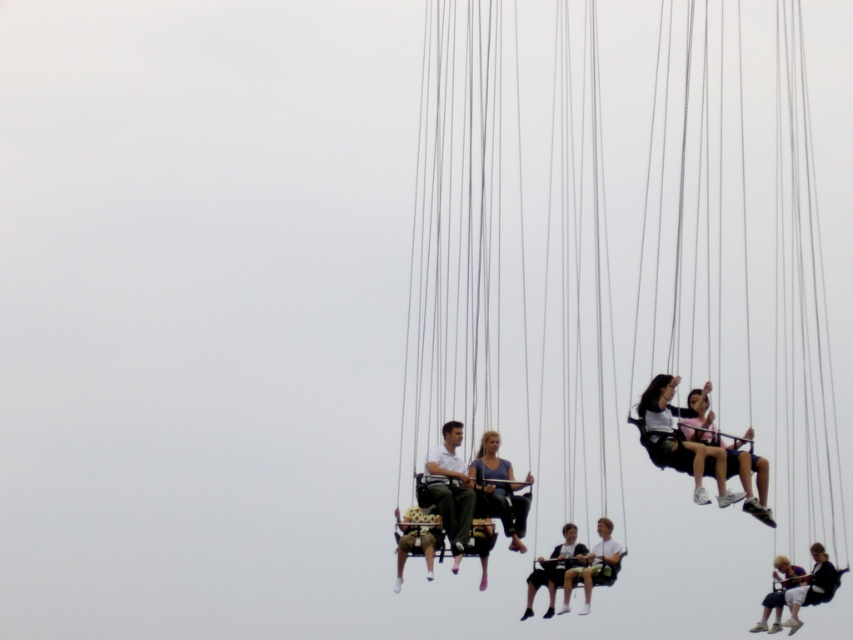
You are standing on the ground looking up at the swing ride. Which swing is closer to the left side of your view, the matte black swing at upper right or the light brown fabric swing at lower right?

The matte black swing at upper right is to the left of the light brown fabric swing at lower right, so it is closer to the left side of your view.

You are standing at the camera position observing the swing ride. There is a point labeled as point (699,394) in the image. If you want to throw a ball to hit that exact point, considering the distance, would you need to throw it harder or softer than a normal throw?

The point (699,394) is 141.54 meters away from the camera. Since this distance is much farther than a normal throw, you would need to throw the ball much harder than a normal throw to reach it.